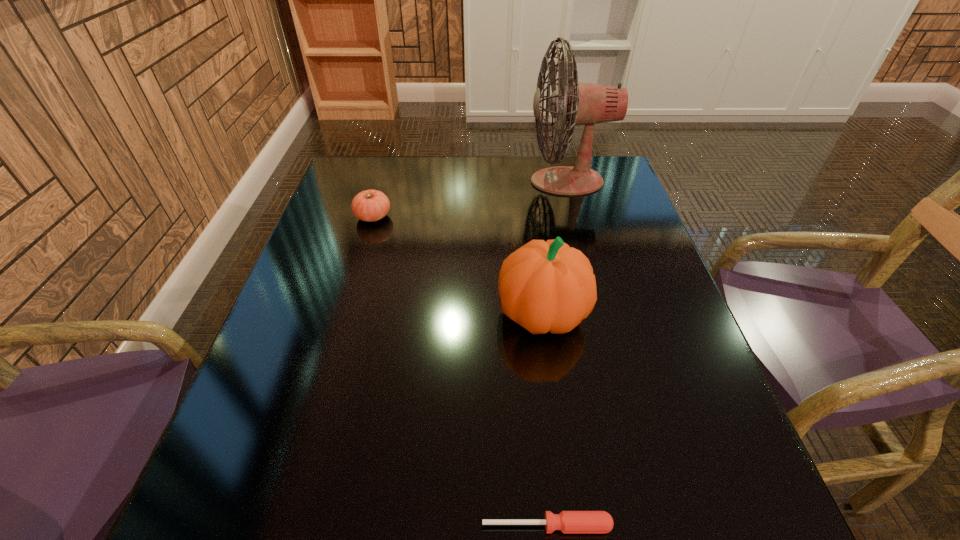
Locate an element on the screen. free spot between the nearest object and the tallest object is located at coordinates (557, 353).

Identify the location of free space that is in between the second nearest object and the nearest object. (544, 420).

You are a GUI agent. You are given a task and a screenshot of the screen. Output one action in this format:
    pyautogui.click(x=<x>, y=<y>)
    Task: Click on the free space between the tallest object and the tomato
    
    Given the screenshot: What is the action you would take?
    pyautogui.click(x=469, y=199)

At what (x,y) coordinates should I click in order to perform the action: click on object identified as the closest to the nearest object. Please return your answer as a coordinate pair (x, y). Image resolution: width=960 pixels, height=540 pixels. Looking at the image, I should click on (543, 286).

At what (x,y) coordinates should I click in order to perform the action: click on object that is the third closest one to the tallest object. Please return your answer as a coordinate pair (x, y). Image resolution: width=960 pixels, height=540 pixels. Looking at the image, I should click on (567, 521).

You are a GUI agent. You are given a task and a screenshot of the screen. Output one action in this format:
    pyautogui.click(x=<x>, y=<y>)
    Task: Click on the vacant area that satisfies the following two spatial constraints: 1. on the back side of the shortest object; 2. on the right side of the second nearest object
    Image resolution: width=960 pixels, height=540 pixels.
    Given the screenshot: What is the action you would take?
    pyautogui.click(x=526, y=313)

Where is `free space in the image that satisfies the following two spatial constraints: 1. on the front side of the third shortest object; 2. on the right side of the second shortest object`? free space in the image that satisfies the following two spatial constraints: 1. on the front side of the third shortest object; 2. on the right side of the second shortest object is located at coordinates (345, 313).

The width and height of the screenshot is (960, 540). Identify the location of free space that satisfies the following two spatial constraints: 1. in front of the tallest object to direct airflow; 2. on the front side of the shortest object. (657, 525).